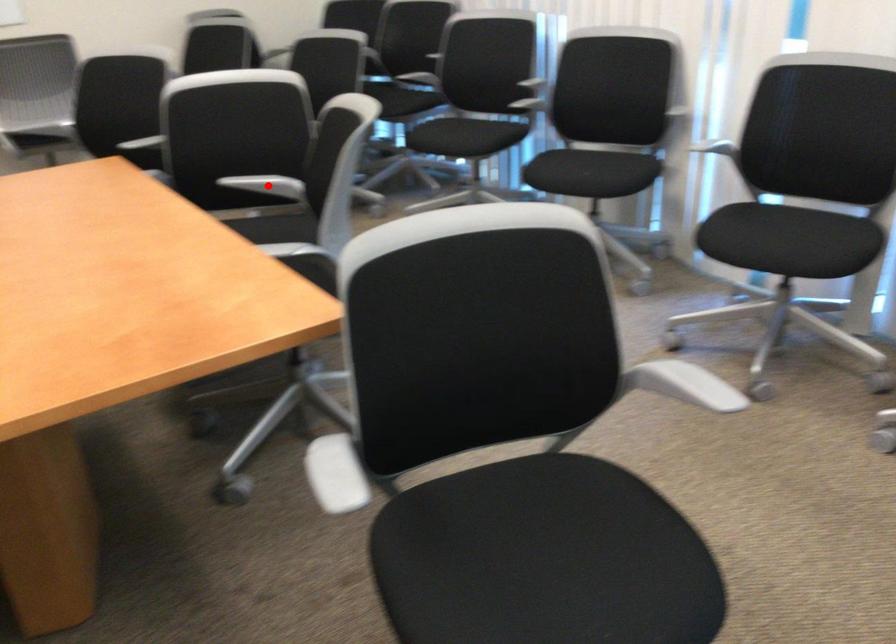
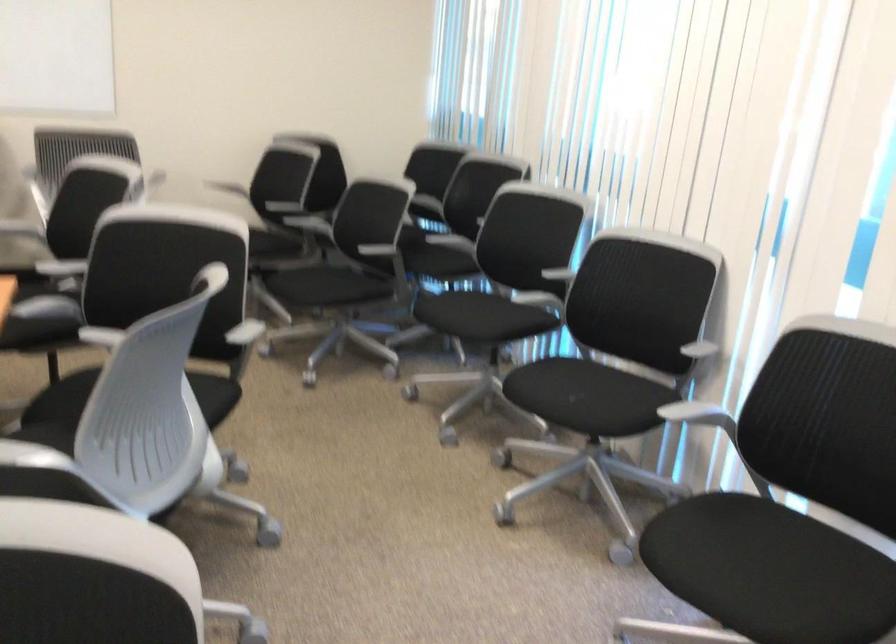
Question: I am providing you with two images of the same scene from different viewpoints. A red point is marked on the first image. At the location where the point appears in image 1, is it still visible in image 2?

Choices:
 (A) Yes
 (B) No

Answer: (B)